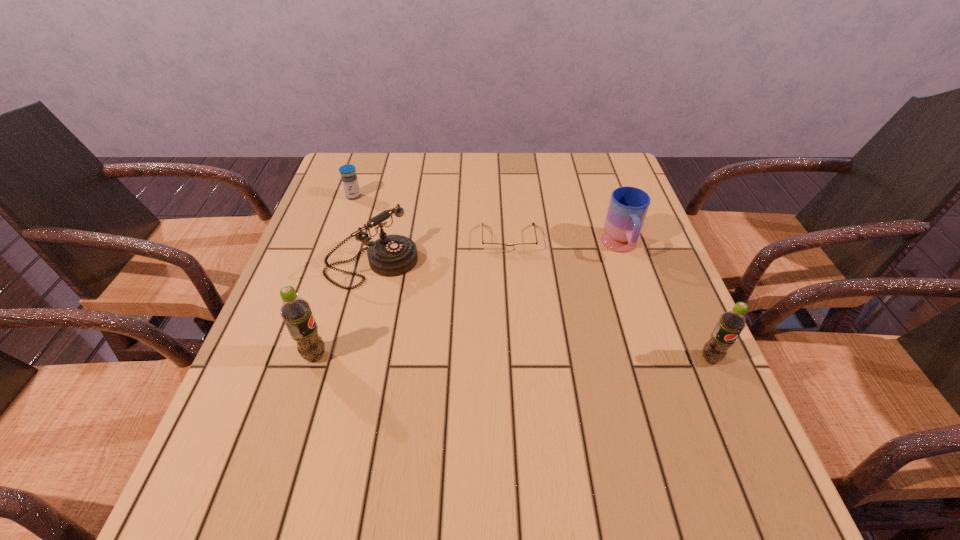
To achieve uniform spacing by inserting another pop_(soda) among them, please point to a free space for this new pop_(soda). Please provide its 2D coordinates. Your answer should be formatted as a tuple, i.e. [(x, y)], where the tuple contains the x and y coordinates of a point satisfying the conditions above.

[(512, 357)]